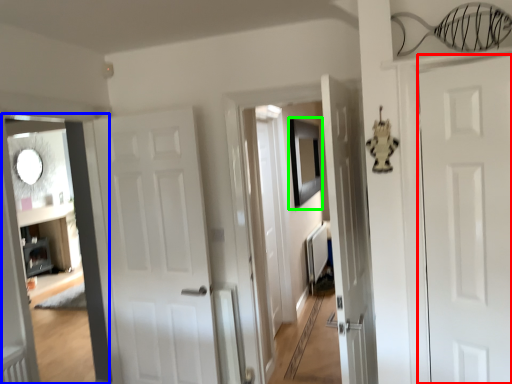
Question: Estimate the real-world distances between objects in this image. Which object is farther from door (highlighted by a red box), corridor (highlighted by a blue box) or picture frame (highlighted by a green box)?

Choices:
 (A) corridor
 (B) picture frame

Answer: (B)